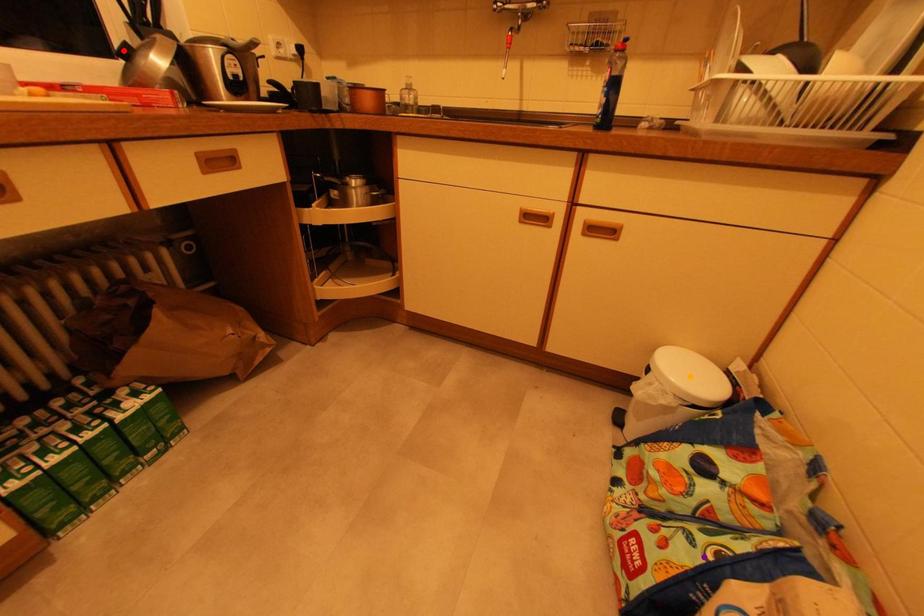
Order these from nearest to farthest:
red point, purple point, orange point

red point < orange point < purple point